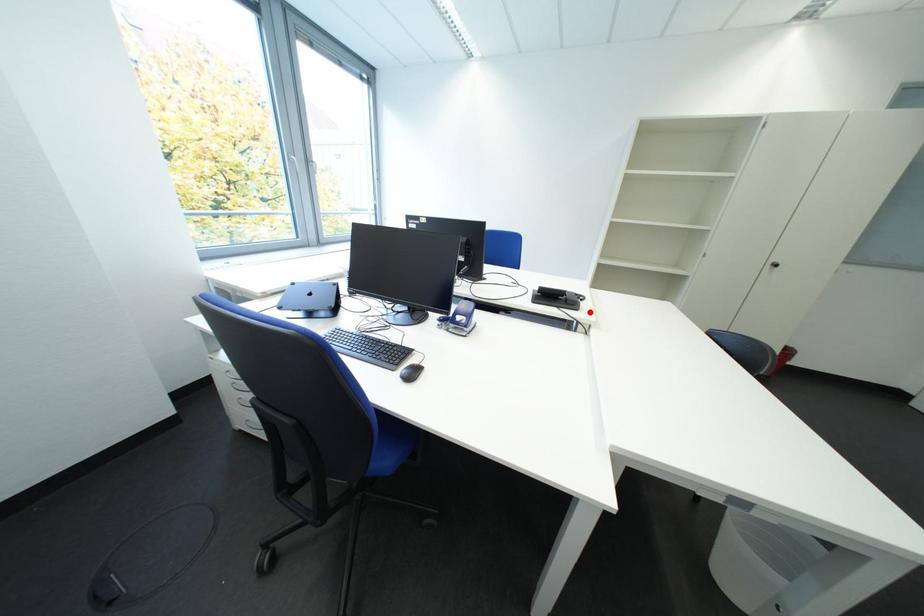
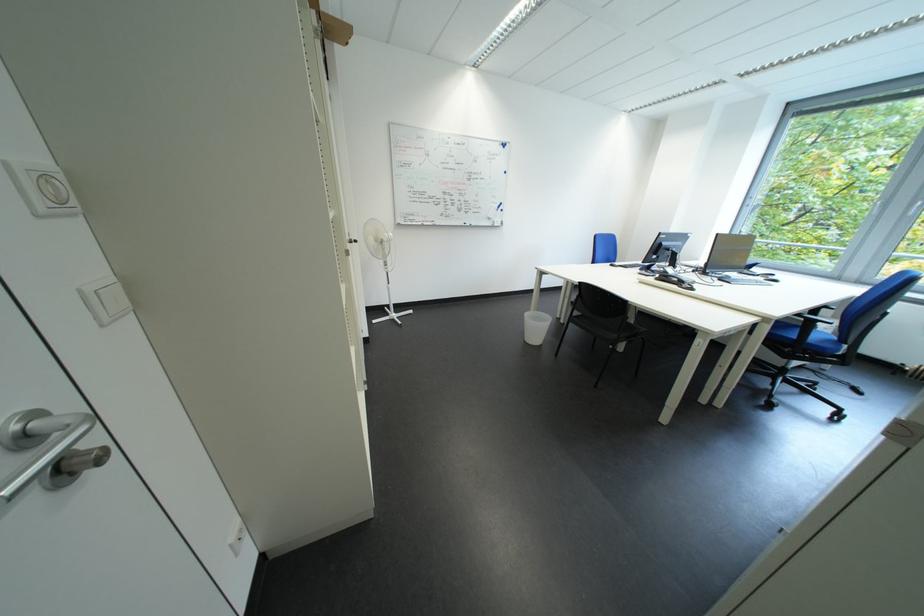
Question: I am providing you with two images of the same scene from different viewpoints. Given a red point in image1, look at the same physical point in image2. Is it:

Choices:
 (A) Closer to the viewpoint
 (B) Farther from the viewpoint

Answer: (A)